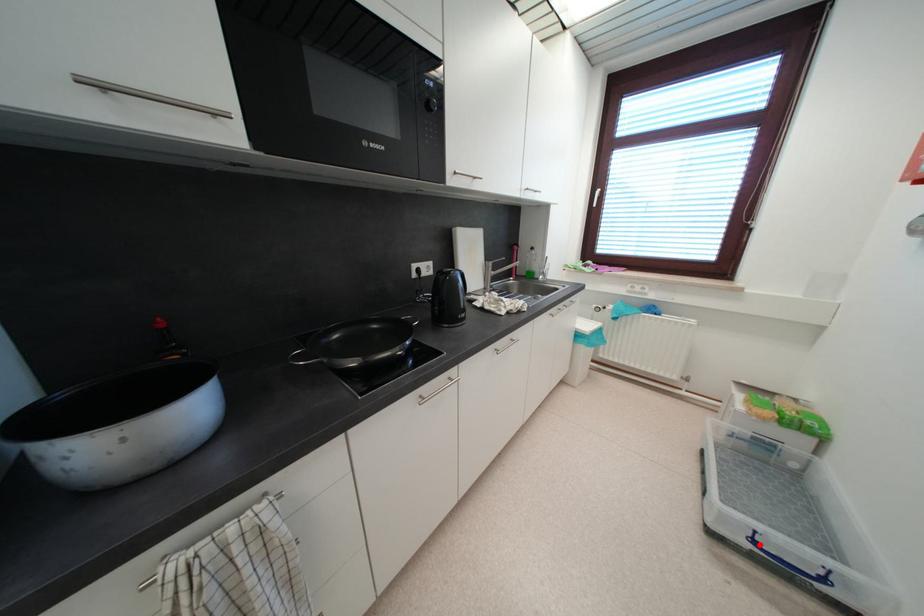
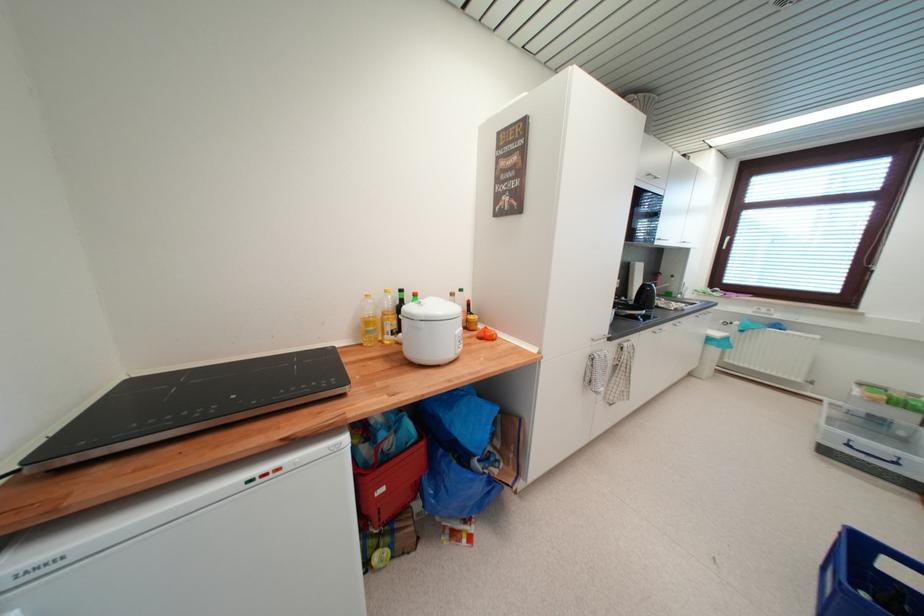
In the second image, find the point that corresponds to the highlighted location in the first image.

(854, 448)